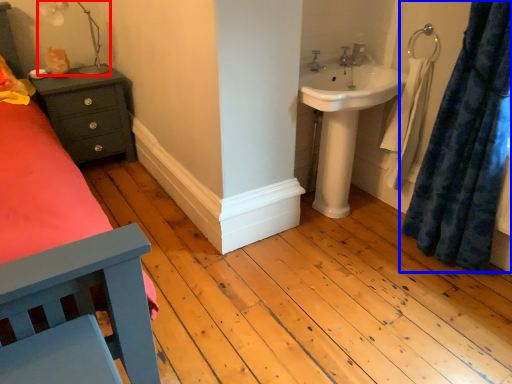
Question: Which point is closer to the camera, lamp (highlighted by a red box) or curtain (highlighted by a blue box)?

Choices:
 (A) lamp
 (B) curtain

Answer: (B)